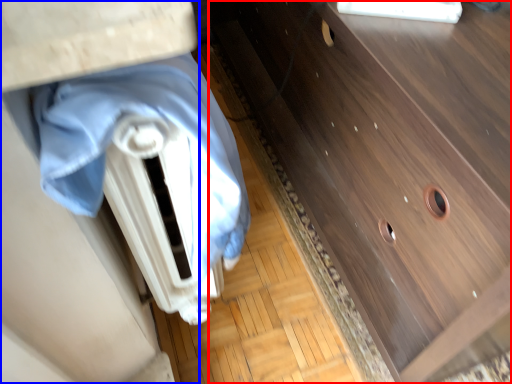
Question: Which point is further to the camera, chest of drawers (highlighted by a red box) or vanity (highlighted by a blue box)?

Choices:
 (A) chest of drawers
 (B) vanity

Answer: (A)